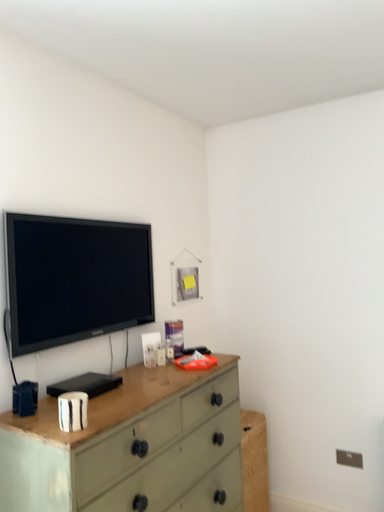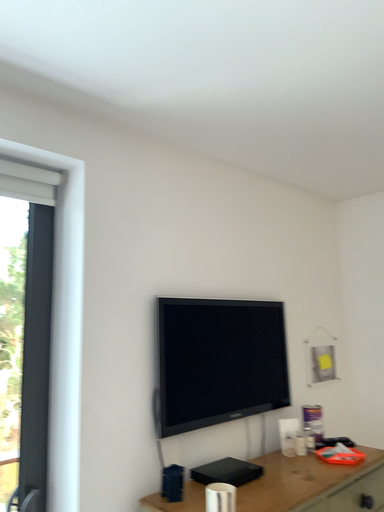
Question: Which way did the camera rotate in the video?

Choices:
 (A) rotated left
 (B) rotated right

Answer: (A)